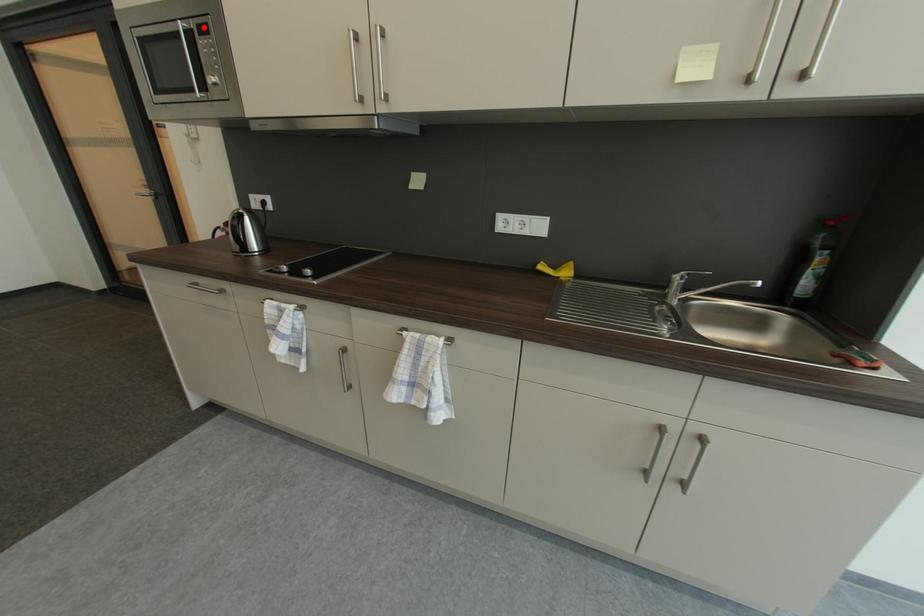
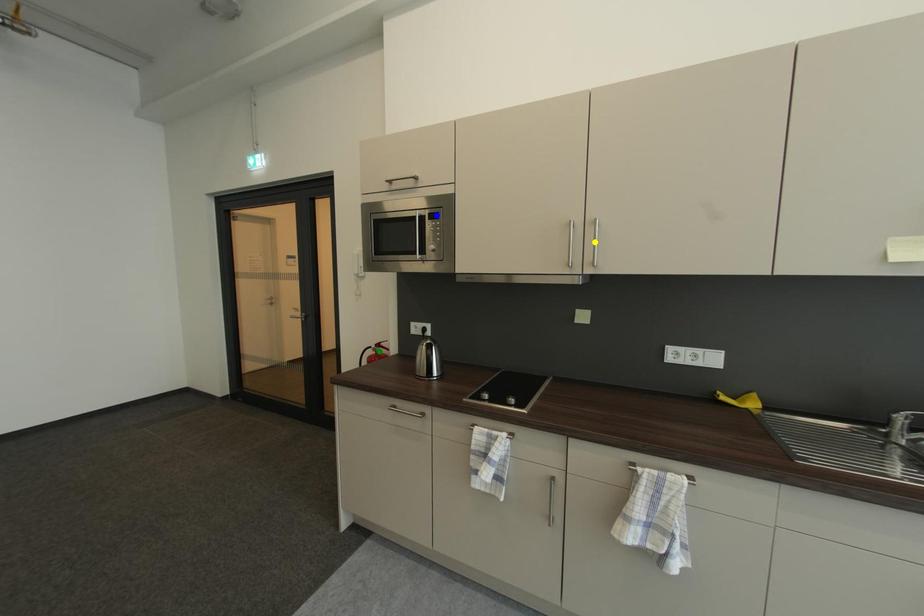
Question: I am providing you with two images of the same scene from different viewpoints. A red point is marked on the first image. You are given multiple points on the second image. Which point in image 2 is actually the same real-world point as the red point in image 1?

Choices:
 (A) green point
 (B) blue point
 (C) yellow point

Answer: (B)